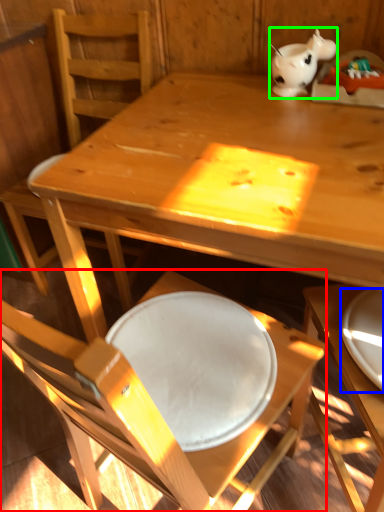
Question: Which object is the farthest from chair (highlighted by a red box)? Choose among these: plate (highlighted by a blue box) or tableware (highlighted by a green box).

Choices:
 (A) plate
 (B) tableware

Answer: (B)